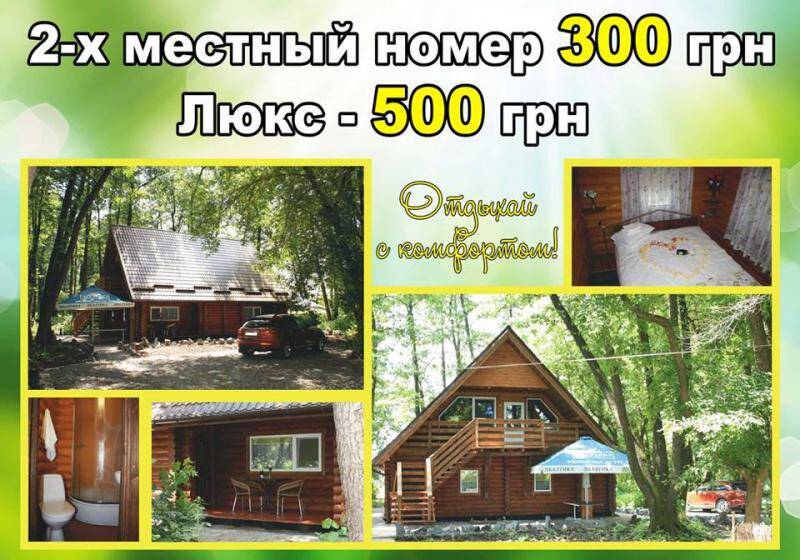
The image size is (800, 560). What are the coordinates of `toilet` in the screenshot? It's located at (52, 515).